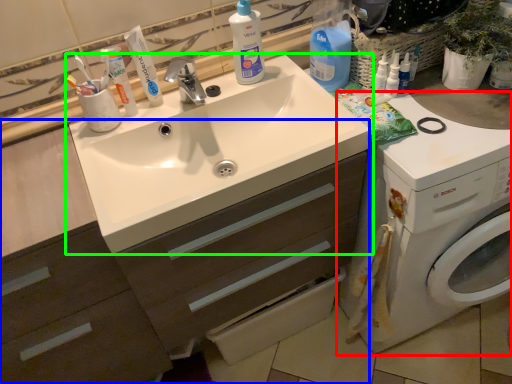
Question: Based on their relative distances, which object is farther from washing machine (highlighted by a red box)? Choose from dresser (highlighted by a blue box) and sink (highlighted by a green box).

Choices:
 (A) dresser
 (B) sink

Answer: (A)